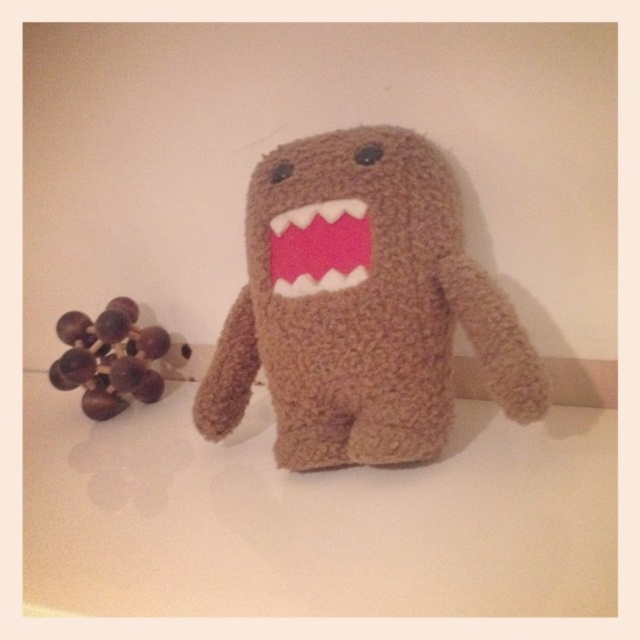
Looking at the image of the Domo plush toy and the spherical object, where is the fuzzy brown plush toy at center in relation to the pink felt mouth at center?

The fuzzy brown plush toy at center is below the pink felt mouth at center.

Where is the fuzzy brown plush toy at center located in the image?

The fuzzy brown plush toy at center is located at point (360, 305) in the image.

You are a toy designer who wants to create a new version of the Domo plush toy. Considering the current design, which part of the fuzzy brown plush toy at center and the pink felt mouth at center should be adjusted to make the mouth more prominent?

The fuzzy brown plush toy at center is much taller than the pink felt mouth at center, so to make the mouth more prominent, you could increase the size of the pink felt mouth at center or reduce the height of the fuzzy brown plush toy at center.